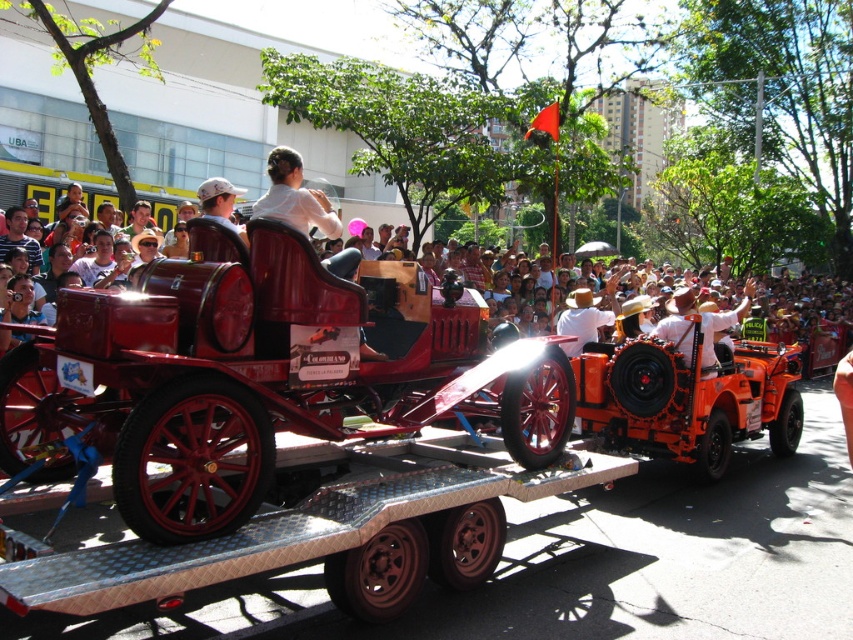
You are a photographer at the parade and want to capture both the white matte shirt at upper center and the orange fabric shirt at center in a single frame. Which shirt should you focus on to ensure both are visible without zooming in too much?

You should focus on the white matte shirt at upper center because it is larger in size than the orange fabric shirt at center, making it easier to include both in the frame without excessive zoom.

You are a photographer at the parade and want to capture the white matte shirt at upper center in your shot. Based on its position, where should you aim your camera?

The white matte shirt at upper center is located at point (x=294, y=196), so aim your camera towards the upper center area of the scene to capture it.